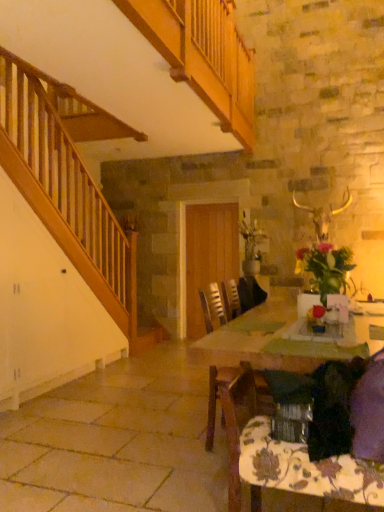
Question: From a real-world perspective, is wooden chair at center positioned under wooden table at center based on gravity?

Choices:
 (A) yes
 (B) no

Answer: (B)

Question: Considering the relative sizes of wooden chair at center and wooden table at center in the image provided, is wooden chair at center wider than wooden table at center?

Choices:
 (A) no
 (B) yes

Answer: (A)

Question: From a real-world perspective, is wooden chair at center positioned over wooden table at center based on gravity?

Choices:
 (A) no
 (B) yes

Answer: (B)

Question: Is the position of wooden chair at center more distant than that of wooden table at center?

Choices:
 (A) no
 (B) yes

Answer: (B)

Question: Does wooden chair at center have a smaller size compared to wooden table at center?

Choices:
 (A) no
 (B) yes

Answer: (B)

Question: Is wooden chair at center positioned before wooden table at center?

Choices:
 (A) no
 (B) yes

Answer: (A)

Question: Does floral-patterned fabric at lower right have a greater height compared to wooden table at center?

Choices:
 (A) yes
 (B) no

Answer: (B)

Question: Considering the relative sizes of floral-patterned fabric at lower right and wooden table at center in the image provided, is floral-patterned fabric at lower right thinner than wooden table at center?

Choices:
 (A) yes
 (B) no

Answer: (A)

Question: From the image's perspective, does floral-patterned fabric at lower right appear lower than wooden table at center?

Choices:
 (A) no
 (B) yes

Answer: (B)

Question: Are floral-patterned fabric at lower right and wooden table at center far apart?

Choices:
 (A) no
 (B) yes

Answer: (A)

Question: From a real-world perspective, is floral-patterned fabric at lower right located higher than wooden table at center?

Choices:
 (A) no
 (B) yes

Answer: (A)

Question: Is wooden table at center completely or partially inside floral-patterned fabric at lower right?

Choices:
 (A) no
 (B) yes

Answer: (A)

Question: Is wooden table at center beside wooden chair at center?

Choices:
 (A) no
 (B) yes

Answer: (A)